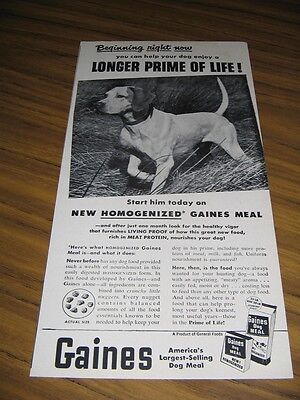
Where is `the left front leg`? The width and height of the screenshot is (300, 400). the left front leg is located at coordinates (160, 173).